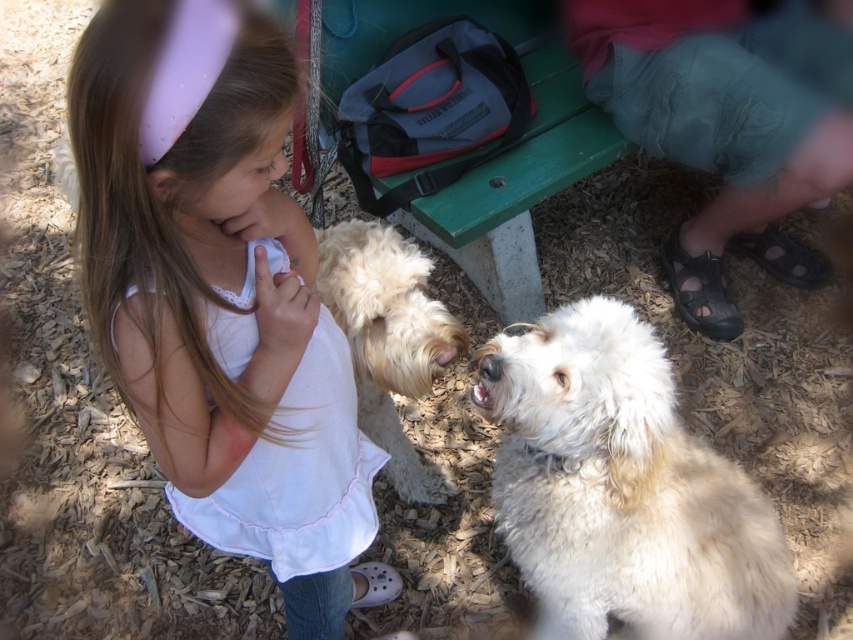
You are a photographer trying to capture a closeup shot of the white cotton dress at center and the fluffy white dog at center. What is the minimum distance you need to maintain between the camera and the subjects to ensure both are in focus?

The minimum distance required is 12.74 inches because the white cotton dress at center and the fluffy white dog at center are 12.74 inches apart, so the camera must be at least that distance away to keep both in focus.

In the scene, there are two dogs at the center. The white fluffy dog at center and the fluffy white dog at center. Which one is positioned lower?

The white fluffy dog at center is positioned lower than the fluffy white dog at center.